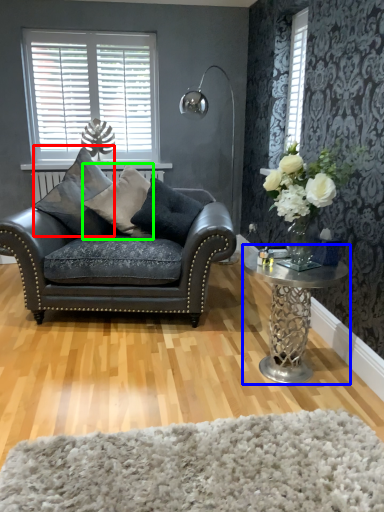
Question: Considering the real-world distances, which object is closest to pillow (highlighted by a red box)? coffee table (highlighted by a blue box) or pillow (highlighted by a green box).

Choices:
 (A) coffee table
 (B) pillow

Answer: (B)